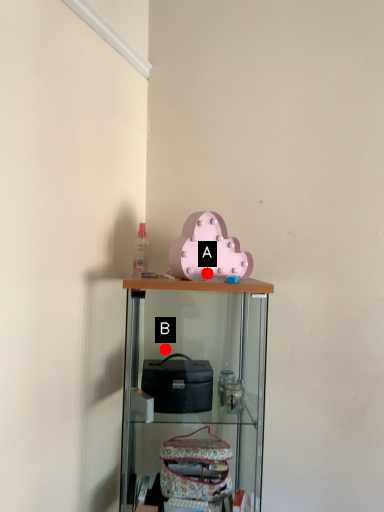
Question: Two points are circled on the image, labeled by A and B beside each circle. Which point appears farthest from the camera in this image?

Choices:
 (A) A is further
 (B) B is further

Answer: (B)